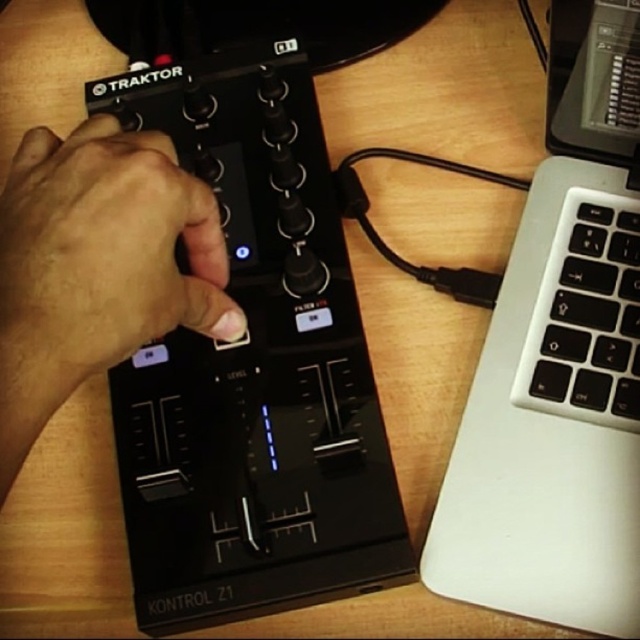
Between black matte hand at center and white plastic keyboard at right, which one is positioned lower?

Positioned lower is white plastic keyboard at right.

In the scene shown: Is black matte hand at center above white plastic keyboard at right?

Yes.

The height and width of the screenshot is (640, 640). In order to click on black matte hand at center in this screenshot , I will do `click(102, 253)`.

Who is shorter, silver/black plastic laptop at right or white plastic keyboard at right?

Standing shorter between the two is white plastic keyboard at right.

Can you confirm if silver/black plastic laptop at right is positioned below white plastic keyboard at right?

Yes, silver/black plastic laptop at right is below white plastic keyboard at right.

This screenshot has width=640, height=640. What do you see at coordinates (561, 364) in the screenshot? I see `silver/black plastic laptop at right` at bounding box center [561, 364].

Where is `silver/black plastic laptop at right`? The image size is (640, 640). silver/black plastic laptop at right is located at coordinates (561, 364).

From the picture: Can you confirm if silver/black plastic laptop at right is smaller than black matte hand at center?

No.

Is point (550, 552) farther from camera compared to point (120, 218)?

Yes, point (550, 552) is farther from viewer.

Find the location of a particular element. The width and height of the screenshot is (640, 640). silver/black plastic laptop at right is located at coordinates (561, 364).